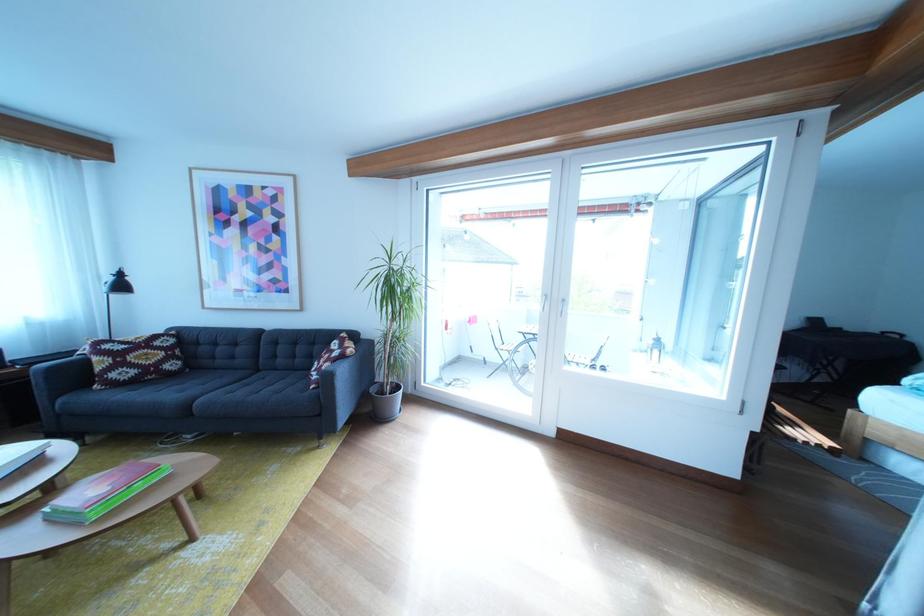
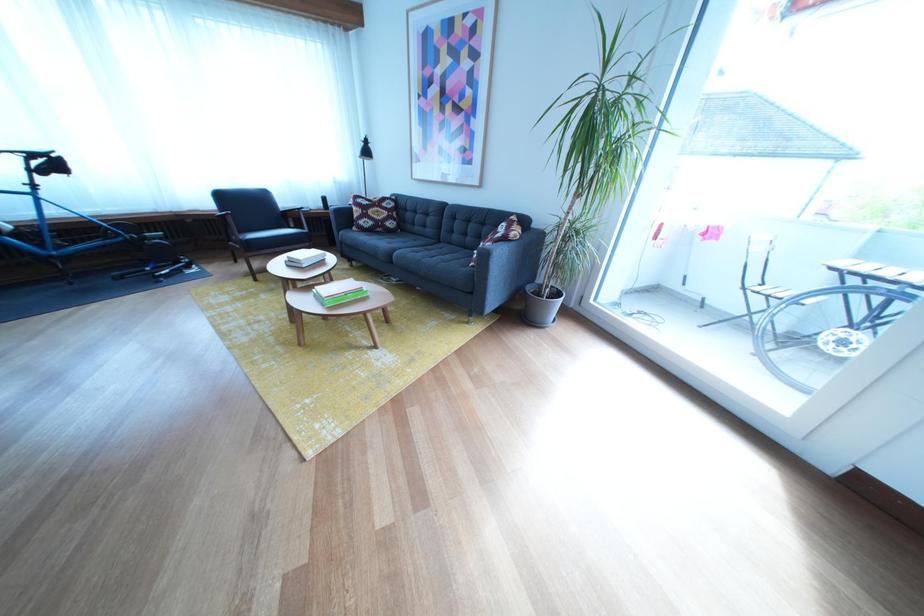
In the second image, find the point that corresponds to the point at 151,363 in the first image.

(386, 219)